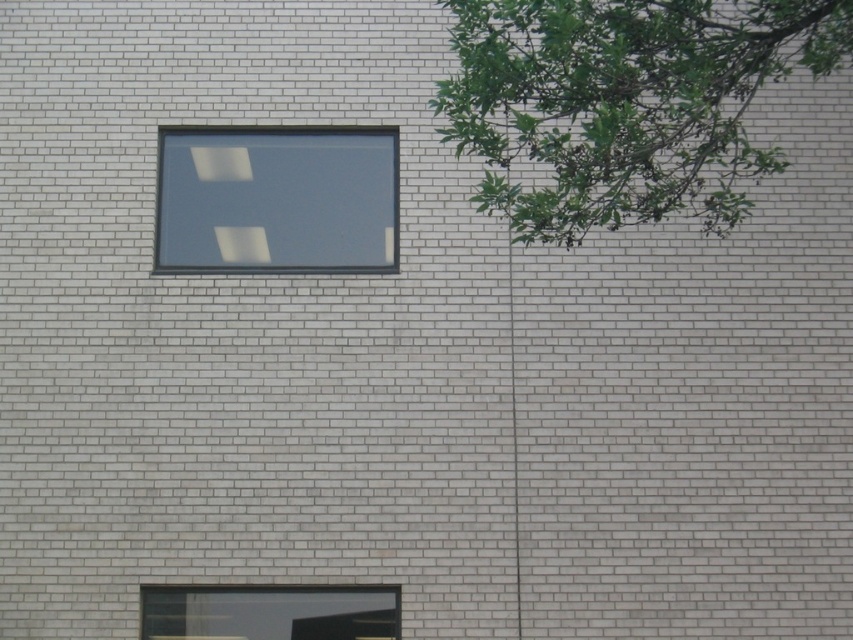
Can you confirm if transparent glass window at upper center is wider than transparent glass window at lower center?

No, transparent glass window at upper center is not wider than transparent glass window at lower center.

Between point (351, 262) and point (363, 620), which one is positioned behind?

The point (351, 262) is more distant.

This screenshot has height=640, width=853. In order to click on transparent glass window at upper center in this screenshot , I will do `click(276, 198)`.

This screenshot has width=853, height=640. Identify the location of transparent glass window at upper center. (276, 198).